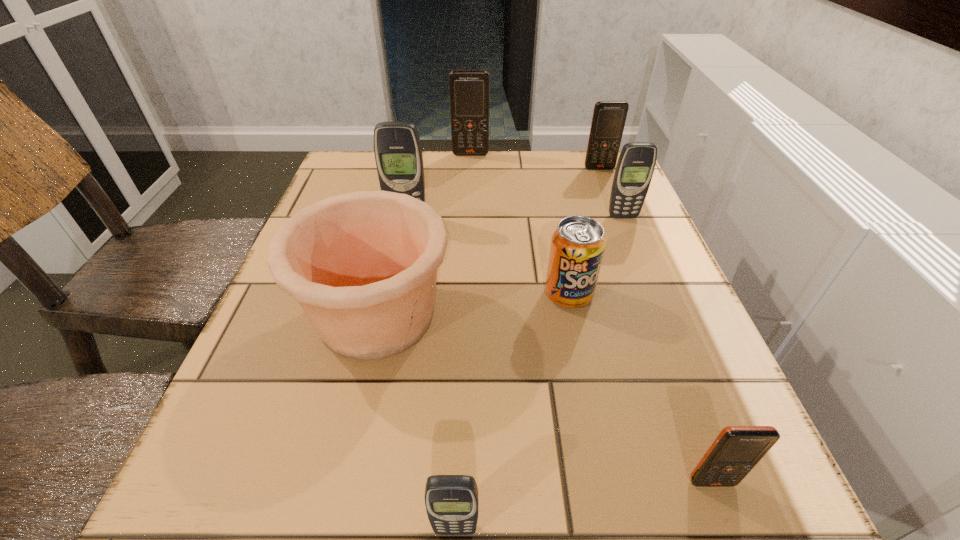
Point out which cellular telephone is positioned as the third nearest to the fifth object from left to right. Please provide its 2D coordinates. Your answer should be formatted as a tuple, i.e. [(x, y)], where the tuple contains the x and y coordinates of a point satisfying the conditions above.

[(398, 154)]

Locate which orange cellular telephone is the second closest to the biggest orange cellular telephone. Please provide its 2D coordinates. Your answer should be formatted as a tuple, i.e. [(x, y)], where the tuple contains the x and y coordinates of a point satisfying the conditions above.

[(734, 453)]

Identify which orange cellular telephone is the third nearest to the nearest object. Please provide its 2D coordinates. Your answer should be formatted as a tuple, i.e. [(x, y)], where the tuple contains the x and y coordinates of a point satisfying the conditions above.

[(469, 89)]

Locate an element on the screen. the closest gray cellular telephone relative to the nearest object is located at coordinates (398, 154).

Image resolution: width=960 pixels, height=540 pixels. What are the coordinates of `gray cellular telephone that is the second closest to the leftmost cellular telephone` in the screenshot? It's located at (451, 501).

You are a GUI agent. You are given a task and a screenshot of the screen. Output one action in this format:
    pyautogui.click(x=<x>, y=<y>)
    Task: Click on the vacant area that satisfies the following two spatial constraints: 1. on the screen of the fourth object from right to left; 2. on the left side of the leftmost gray cellular telephone
    
    Given the screenshot: What is the action you would take?
    pyautogui.click(x=392, y=294)